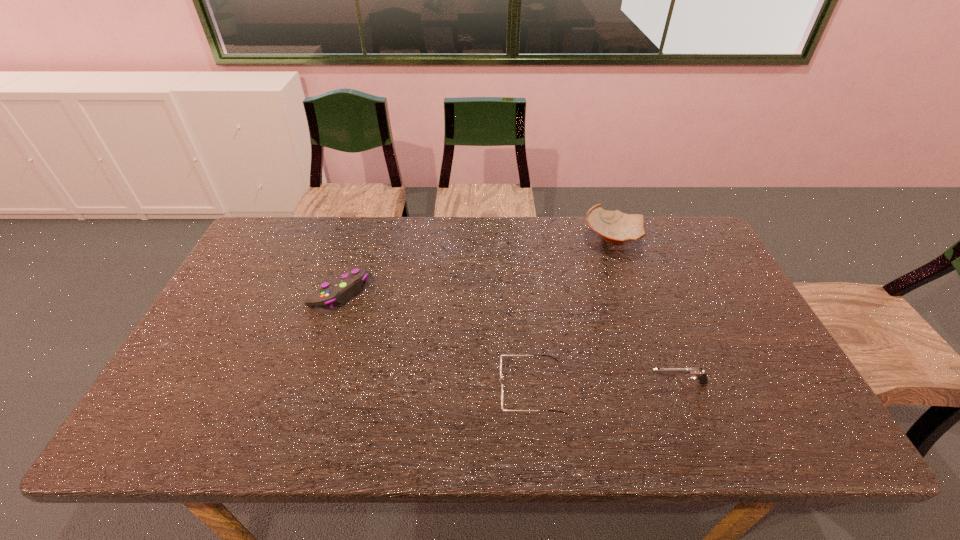
The image size is (960, 540). Identify the location of vacant space in between the third object from right to left and the pottery. (572, 314).

You are a GUI agent. You are given a task and a screenshot of the screen. Output one action in this format:
    pyautogui.click(x=<x>, y=<y>)
    Task: Click on the free spot between the second object from left to right and the pistol
    
    Given the screenshot: What is the action you would take?
    pyautogui.click(x=604, y=386)

Point out which object is positioned as the second nearest to the tallest object. Please provide its 2D coordinates. Your answer should be formatted as a tuple, i.e. [(x, y)], where the tuple contains the x and y coordinates of a point satisfying the conditions above.

[(697, 372)]

Identify which object is the nearest to the tallest object. Please provide its 2D coordinates. Your answer should be formatted as a tuple, i.e. [(x, y)], where the tuple contains the x and y coordinates of a point satisfying the conditions above.

[(501, 356)]

The height and width of the screenshot is (540, 960). What are the coordinates of `free space in the image that satisfies the following two spatial constraints: 1. on the back side of the pottery; 2. on the left side of the leftmost object` in the screenshot? It's located at (357, 239).

Locate an element on the screen. free space that satisfies the following two spatial constraints: 1. on the front side of the farthest object; 2. on the front-facing side of the third object from right to left is located at coordinates (665, 389).